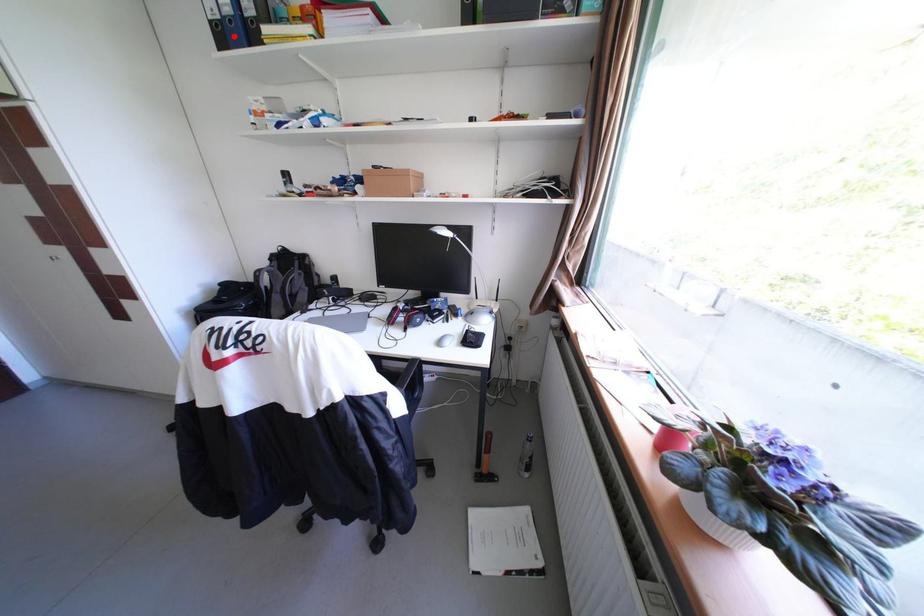
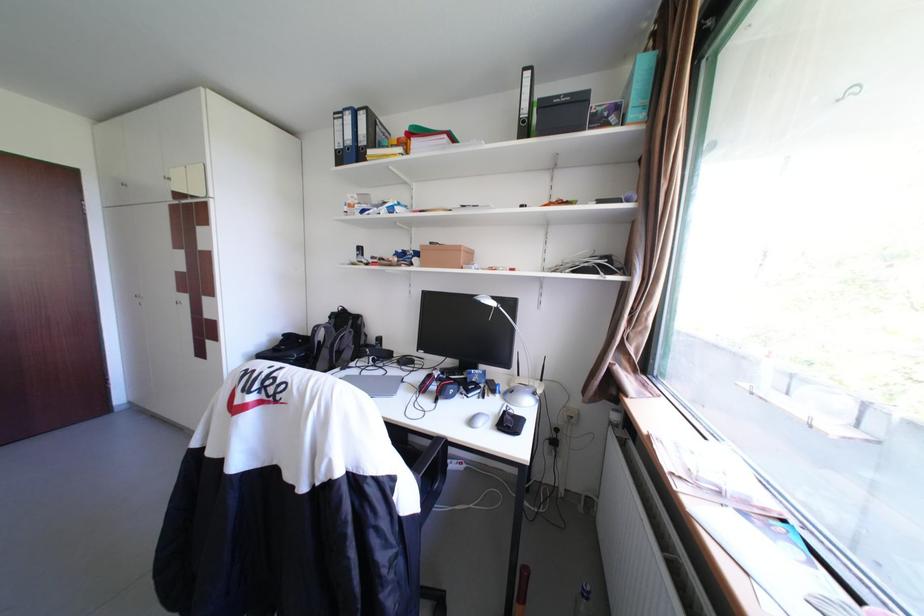
Find the pixel in the second image that matches the highlighted location in the first image.

(351, 158)